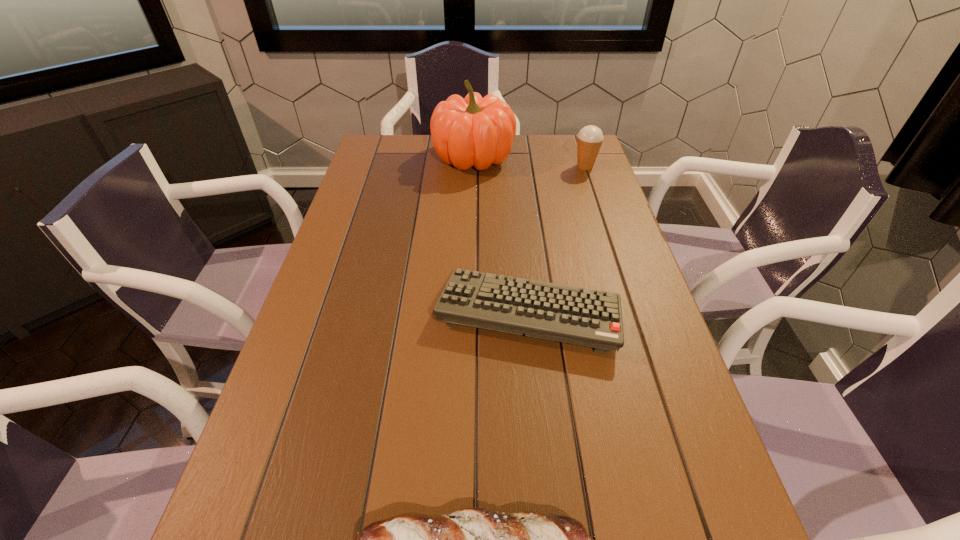
Identify the location of pumpkin. (474, 131).

Find the location of a particular element. The height and width of the screenshot is (540, 960). icecream is located at coordinates (589, 139).

Locate an element on the screen. The height and width of the screenshot is (540, 960). the shortest object is located at coordinates (574, 315).

The width and height of the screenshot is (960, 540). What are the coordinates of `the second nearest object` in the screenshot? It's located at (574, 315).

Where is `vacant area situated 0.150m on the right of the pumpkin`? vacant area situated 0.150m on the right of the pumpkin is located at coordinates (559, 157).

Locate an element on the screen. Image resolution: width=960 pixels, height=540 pixels. vacant space located 0.150m on the front of the second tallest object is located at coordinates (596, 199).

Find the location of a particular element. The width and height of the screenshot is (960, 540). free location located on the front of the shortest object is located at coordinates (540, 422).

Where is `pumpkin that is at the far edge`? The image size is (960, 540). pumpkin that is at the far edge is located at coordinates (474, 131).

The width and height of the screenshot is (960, 540). What are the coordinates of `icecream that is at the far edge` in the screenshot? It's located at (589, 139).

You are a GUI agent. You are given a task and a screenshot of the screen. Output one action in this format:
    pyautogui.click(x=<x>, y=<y>)
    Task: Click on the icecream at the right edge
    The width and height of the screenshot is (960, 540).
    Given the screenshot: What is the action you would take?
    pyautogui.click(x=589, y=139)